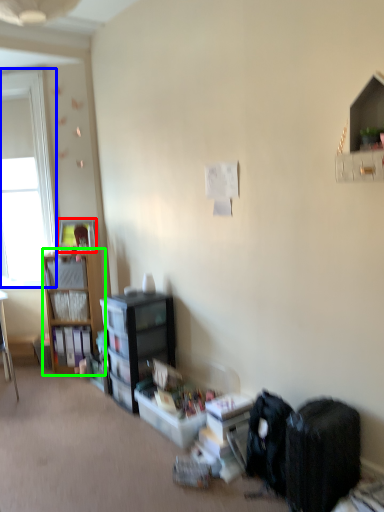
Question: Which object is positioned farthest from picture frame (highlighted by a red box)? Select from window screen (highlighted by a blue box) and cabinetry (highlighted by a green box).

Choices:
 (A) window screen
 (B) cabinetry

Answer: (A)